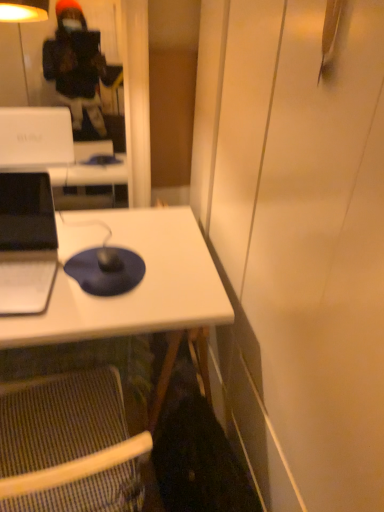
Describe the element at coordinates (135, 287) in the screenshot. I see `white matte desk at center` at that location.

Describe the element at coordinates (69, 446) in the screenshot. I see `striped fabric folding chair at lower left` at that location.

Looking at this image, measure the distance between blue matte mousepad at center and camera.

blue matte mousepad at center is 1.12 meters away from camera.

What do you see at coordinates (26, 243) in the screenshot? I see `matte black laptop at left` at bounding box center [26, 243].

The height and width of the screenshot is (512, 384). I want to click on white matte desk at center, so click(135, 287).

From the image's perspective, is blue matte mousepad at center located beneath striped fabric folding chair at lower left?

No, from the image's perspective, blue matte mousepad at center is not beneath striped fabric folding chair at lower left.

From a real-world perspective, who is located lower, blue matte mousepad at center or striped fabric folding chair at lower left?

In real-world perspective, striped fabric folding chair at lower left is lower.

Between point (94, 248) and point (65, 455), which one is positioned in front?

The point (65, 455) is in front.

Can you confirm if blue matte mousepad at center is shorter than striped fabric folding chair at lower left?

Yes.

Considering the points (10, 215) and (125, 237), which point is in front, point (10, 215) or point (125, 237)?

Positioned in front is point (10, 215).

Identify the location of desk behind the matte black laptop at left. The image size is (384, 512). (135, 287).

From a real-world perspective, is matte black laptop at left physically above white matte desk at center?

Correct, in the physical world, matte black laptop at left is higher than white matte desk at center.

From the image's perspective, is white matte desk at center on top of striped fabric folding chair at lower left?

Yes, from the image's perspective, white matte desk at center is above striped fabric folding chair at lower left.

Is white matte desk at center far away from striped fabric folding chair at lower left?

No, white matte desk at center is in close proximity to striped fabric folding chair at lower left.

Where is `folding chair on the right of white matte desk at center`? Image resolution: width=384 pixels, height=512 pixels. folding chair on the right of white matte desk at center is located at coordinates (69, 446).

From a real-world perspective, is matte black laptop at left above or below blue matte mousepad at center?

matte black laptop at left is above blue matte mousepad at center.

Would you say matte black laptop at left is inside or outside blue matte mousepad at center?

matte black laptop at left is not inside blue matte mousepad at center, it's outside.

Where is `laptop above the blue matte mousepad at center (from the image's perspective)`? laptop above the blue matte mousepad at center (from the image's perspective) is located at coordinates (26, 243).

Is matte black laptop at left facing away from blue matte mousepad at center?

matte black laptop at left is not turned away from blue matte mousepad at center.

Can you see blue matte mousepad at center touching matte black laptop at left?

No, blue matte mousepad at center is not in contact with matte black laptop at left.

Could you tell me if blue matte mousepad at center is facing matte black laptop at left?

No, blue matte mousepad at center does not turn towards matte black laptop at left.

Who is taller, blue matte mousepad at center or matte black laptop at left?

Standing taller between the two is matte black laptop at left.

Can we say blue matte mousepad at center lies outside matte black laptop at left?

Absolutely, blue matte mousepad at center is external to matte black laptop at left.

Can you confirm if matte black laptop at left is bigger than striped fabric folding chair at lower left?

Actually, matte black laptop at left might be smaller than striped fabric folding chair at lower left.

How distant is matte black laptop at left from striped fabric folding chair at lower left?

matte black laptop at left is 14.97 inches away from striped fabric folding chair at lower left.

Considering the sizes of objects matte black laptop at left and striped fabric folding chair at lower left in the image provided, who is shorter, matte black laptop at left or striped fabric folding chair at lower left?

matte black laptop at left is shorter.

Considering the sizes of objects matte black laptop at left and striped fabric folding chair at lower left in the image provided, who is thinner, matte black laptop at left or striped fabric folding chair at lower left?

With smaller width is matte black laptop at left.

Between white matte desk at center and matte black laptop at left, which one appears on the left side from the viewer's perspective?

matte black laptop at left is more to the left.

Does point (190, 243) appear closer or farther from the camera than point (34, 273)?

Clearly, point (190, 243) is more distant from the camera than point (34, 273).

How many degrees apart are the facing directions of white matte desk at center and matte black laptop at left?

There is a 4.37-degree angle between the facing directions of white matte desk at center and matte black laptop at left.

Locate an element on the screen. The width and height of the screenshot is (384, 512). folding chair that appears in front of the blue matte mousepad at center is located at coordinates (69, 446).

The height and width of the screenshot is (512, 384). Find the location of `desk located below the matte black laptop at left (from the image's perspective)`. desk located below the matte black laptop at left (from the image's perspective) is located at coordinates (135, 287).

Consider the image. Considering their positions, is white matte desk at center positioned closer to blue matte mousepad at center than matte black laptop at left?

white matte desk at center.

From the image, which object appears to be nearer to striped fabric folding chair at lower left, white matte desk at center or blue matte mousepad at center?

white matte desk at center.

Considering their positions, is striped fabric folding chair at lower left positioned further to blue matte mousepad at center than white matte desk at center?

Based on the image, striped fabric folding chair at lower left appears to be further to blue matte mousepad at center.

From the image, which object appears to be farther from striped fabric folding chair at lower left, blue matte mousepad at center or matte black laptop at left?

matte black laptop at left.

In the scene shown: Estimate the real-world distances between objects in this image. Which object is further from matte black laptop at left, blue matte mousepad at center or white matte desk at center?

white matte desk at center.

Based on their spatial positions, is matte black laptop at left or blue matte mousepad at center closer to striped fabric folding chair at lower left?

Among the two, blue matte mousepad at center is located nearer to striped fabric folding chair at lower left.

Looking at the image, which one is located further to striped fabric folding chair at lower left, blue matte mousepad at center or white matte desk at center?

Based on the image, blue matte mousepad at center appears to be further to striped fabric folding chair at lower left.

Looking at this image, which object lies nearer to the anchor point matte black laptop at left, striped fabric folding chair at lower left or blue matte mousepad at center?

Based on the image, blue matte mousepad at center appears to be nearer to matte black laptop at left.

What are the coordinates of `mousepad between matte black laptop at left and striped fabric folding chair at lower left in the vertical direction` in the screenshot? It's located at (106, 270).

I want to click on desk between matte black laptop at left and striped fabric folding chair at lower left in the vertical direction, so [x=135, y=287].

Find the location of a particular element. This screenshot has height=512, width=384. mousepad that lies between matte black laptop at left and white matte desk at center from top to bottom is located at coordinates (106, 270).

This screenshot has width=384, height=512. I want to click on desk between blue matte mousepad at center and striped fabric folding chair at lower left vertically, so click(135, 287).